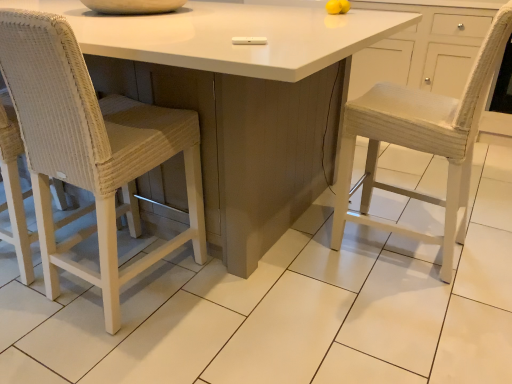
Find the location of a particular element. woven wicker chair at left is located at coordinates (91, 149).

Image resolution: width=512 pixels, height=384 pixels. Describe the element at coordinates (91, 149) in the screenshot. I see `woven wicker chair at left` at that location.

Where is `white glossy table at center`? This screenshot has width=512, height=384. white glossy table at center is located at coordinates [237, 99].

This screenshot has width=512, height=384. Describe the element at coordinates (237, 99) in the screenshot. I see `white glossy table at center` at that location.

The image size is (512, 384). Identify the location of woven wicker chair at left. (91, 149).

In the image, is white glossy table at center on the left side or the right side of woven wicker chair at left?

From the image, it's evident that white glossy table at center is to the left of woven wicker chair at left.

Considering the positions of objects white glossy table at center and woven wicker chair at left in the image provided, who is behind, white glossy table at center or woven wicker chair at left?

Positioned behind is woven wicker chair at left.

Which point is more forward, (205, 131) or (86, 169)?

Positioned in front is point (86, 169).

From the image's perspective, is white glossy table at center located above or below woven wicker chair at left?

Based on their image positions, white glossy table at center is located above woven wicker chair at left.

From a real-world perspective, who is located higher, white glossy table at center or woven wicker chair at left?

woven wicker chair at left, from a real-world perspective.

Is white glossy table at center wider or thinner than woven wicker chair at left?

Clearly, white glossy table at center has more width compared to woven wicker chair at left.

Considering the relative sizes of white glossy table at center and woven wicker chair at left in the image provided, is white glossy table at center taller than woven wicker chair at left?

Incorrect, the height of white glossy table at center is not larger of that of woven wicker chair at left.

Considering the sizes of white glossy table at center and woven wicker chair at left in the image, is white glossy table at center bigger or smaller than woven wicker chair at left?

Considering their sizes, white glossy table at center takes up more space than woven wicker chair at left.

In the scene shown: Is woven wicker chair at left located within white glossy table at center?

Yes, woven wicker chair at left can be found within white glossy table at center.

Are white glossy table at center and woven wicker chair at left located far from each other?

That's not correct — white glossy table at center is a little close to woven wicker chair at left.

Is white glossy table at center turned away from woven wicker chair at left?

Absolutely, white glossy table at center is directed away from woven wicker chair at left.

What's the angular difference between white glossy table at center and woven wicker chair at left's facing directions?

white glossy table at center and woven wicker chair at left are facing 180 degrees away from each other.

At what (x,y) coordinates should I click in order to perform the action: click on table that appears above the woven wicker chair at left (from the image's perspective). Please return your answer as a coordinate pair (x, y). The image size is (512, 384). Looking at the image, I should click on (237, 99).

Which object is positioned more to the left, woven wicker chair at left or white glossy table at center?

Positioned to the left is white glossy table at center.

Who is more distant, woven wicker chair at left or white glossy table at center?

woven wicker chair at left.

Considering the positions of point (124, 279) and point (227, 261), is point (124, 279) closer or farther from the camera than point (227, 261)?

Point (124, 279) is closer to the camera than point (227, 261).

From the image's perspective, is woven wicker chair at left on top of white glossy table at center?

No, from the image's perspective, woven wicker chair at left is not above white glossy table at center.

Based on the photo, from a real-world perspective, is woven wicker chair at left on white glossy table at center?

Indeed, from a real-world perspective, woven wicker chair at left stands above white glossy table at center.

Which object is wider, woven wicker chair at left or white glossy table at center?

With larger width is white glossy table at center.

Can you confirm if woven wicker chair at left is taller than white glossy table at center?

Yes.

Which of these two, woven wicker chair at left or white glossy table at center, is smaller?

With smaller size is woven wicker chair at left.

Is woven wicker chair at left inside or outside of white glossy table at center?

woven wicker chair at left is located inside white glossy table at center.

Can you see woven wicker chair at left touching white glossy table at center?

No.

Is woven wicker chair at left aimed at white glossy table at center?

Yes, woven wicker chair at left is turned towards white glossy table at center.

How different are the orientations of woven wicker chair at left and white glossy table at center in degrees?

The facing directions of woven wicker chair at left and white glossy table at center are 180 degrees apart.

Measure the distance from woven wicker chair at left to white glossy table at center.

13.39 inches.

Identify the location of chair behind the white glossy table at center. This screenshot has height=384, width=512. click(x=91, y=149).

Find the location of a particular element. This screenshot has height=384, width=512. table located on the left of woven wicker chair at left is located at coordinates (237, 99).

Image resolution: width=512 pixels, height=384 pixels. Identify the location of chair on the right of white glossy table at center. (91, 149).